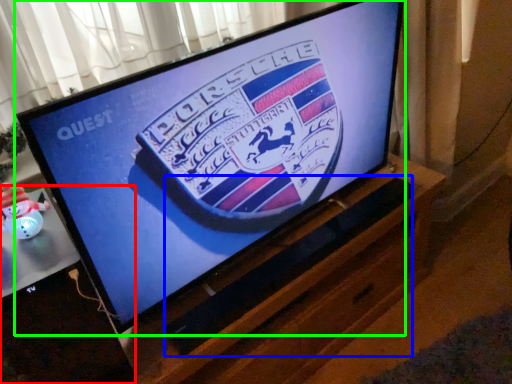
Question: Which is nearer to the desktop (highlighted by a red box)? speaker (highlighted by a blue box) or television (highlighted by a green box).

Choices:
 (A) speaker
 (B) television

Answer: (B)